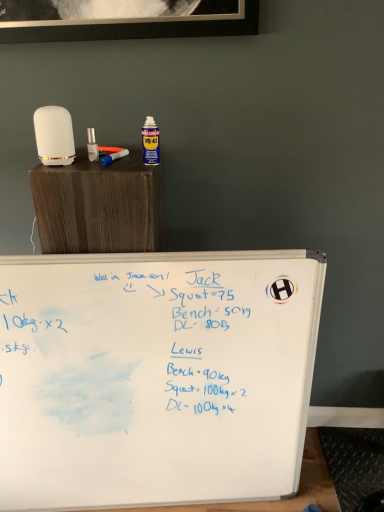
At what (x,y) coordinates should I click in order to perform the action: click on whiteboard at lower center. Please return your answer as a coordinate pair (x, y). Looking at the image, I should click on (271, 499).

What is the approximate width of whiteboard at lower center?

whiteboard at lower center is 16.76 inches wide.

What do you see at coordinates (271, 499) in the screenshot?
I see `whiteboard at lower center` at bounding box center [271, 499].

I want to click on blue plastic paint brush at upper left, so click(x=114, y=157).

Measure the distance between blue plastic paint brush at upper left and camera.

The depth of blue plastic paint brush at upper left is 3.52 feet.

Describe the element at coordinates (114, 157) in the screenshot. The height and width of the screenshot is (512, 384). I see `blue plastic paint brush at upper left` at that location.

At what (x,y) coordinates should I click in order to perform the action: click on whiteboard at lower center. Please return your answer as a coordinate pair (x, y). This screenshot has height=512, width=384. Looking at the image, I should click on (271, 499).

Based on their positions, is blue plastic paint brush at upper left located to the left or right of whiteboard at lower center?

In the image, blue plastic paint brush at upper left appears on the left side of whiteboard at lower center.

Is blue plastic paint brush at upper left in front of or behind whiteboard at lower center in the image?

blue plastic paint brush at upper left is positioned closer to the viewer than whiteboard at lower center.

Considering the positions of point (112, 154) and point (320, 486), is point (112, 154) closer or farther from the camera than point (320, 486)?

Point (112, 154).

From the image's perspective, is blue plastic paint brush at upper left above or below whiteboard at lower center?

Based on their image positions, blue plastic paint brush at upper left is located above whiteboard at lower center.

From a real-world perspective, which is physically below, blue plastic paint brush at upper left or whiteboard at lower center?

In real-world perspective, whiteboard at lower center is lower.

Considering the relative sizes of blue plastic paint brush at upper left and whiteboard at lower center in the image provided, is blue plastic paint brush at upper left wider than whiteboard at lower center?

No.

Does blue plastic paint brush at upper left have a lesser height compared to whiteboard at lower center?

Correct, blue plastic paint brush at upper left is not as tall as whiteboard at lower center.

Is blue plastic paint brush at upper left bigger than whiteboard at lower center?

Actually, blue plastic paint brush at upper left might be smaller than whiteboard at lower center.

Choose the correct answer: Is blue plastic paint brush at upper left inside whiteboard at lower center or outside it?

blue plastic paint brush at upper left lies outside whiteboard at lower center.

Is blue plastic paint brush at upper left not near whiteboard at lower center?

blue plastic paint brush at upper left is positioned a significant distance from whiteboard at lower center.

Is blue plastic paint brush at upper left oriented away from whiteboard at lower center?

blue plastic paint brush at upper left does not have its back to whiteboard at lower center.

How different are the orientations of blue plastic paint brush at upper left and whiteboard at lower center in degrees?

They differ by 163 degrees in their facing directions.

In the image, there is a blue plastic paint brush at upper left. Where is `table below it (from the image's perspective)`? Image resolution: width=384 pixels, height=512 pixels. table below it (from the image's perspective) is located at coordinates (271, 499).

Based on their positions, is whiteboard at lower center located to the left or right of blue plastic paint brush at upper left?

whiteboard at lower center is to the right of blue plastic paint brush at upper left.

Which object is more forward, whiteboard at lower center or blue plastic paint brush at upper left?

Positioned in front is blue plastic paint brush at upper left.

Which is closer to the camera, (263, 507) or (126, 153)?

Point (263, 507).

From the image's perspective, does whiteboard at lower center appear lower than blue plastic paint brush at upper left?

Yes.

From a real-world perspective, is whiteboard at lower center located higher than blue plastic paint brush at upper left?

No, from a real-world perspective, whiteboard at lower center is not on top of blue plastic paint brush at upper left.

Between whiteboard at lower center and blue plastic paint brush at upper left, which one has larger width?

whiteboard at lower center.

Which of these two, whiteboard at lower center or blue plastic paint brush at upper left, stands shorter?

blue plastic paint brush at upper left.

In the scene shown: Looking at the image, does whiteboard at lower center seem bigger or smaller compared to blue plastic paint brush at upper left?

Considering their sizes, whiteboard at lower center takes up more space than blue plastic paint brush at upper left.

Can blue plastic paint brush at upper left be found inside whiteboard at lower center?

No, blue plastic paint brush at upper left is not inside whiteboard at lower center.

Is whiteboard at lower center touching blue plastic paint brush at upper left?

No, whiteboard at lower center is not making contact with blue plastic paint brush at upper left.

Could you tell me if whiteboard at lower center is facing blue plastic paint brush at upper left?

No.

Where is `table to the right of blue plastic paint brush at upper left`? table to the right of blue plastic paint brush at upper left is located at coordinates (271, 499).

Identify the location of table located below the blue plastic paint brush at upper left (from the image's perspective). (271, 499).

The height and width of the screenshot is (512, 384). In order to click on table behind the blue plastic paint brush at upper left in this screenshot , I will do `click(271, 499)`.